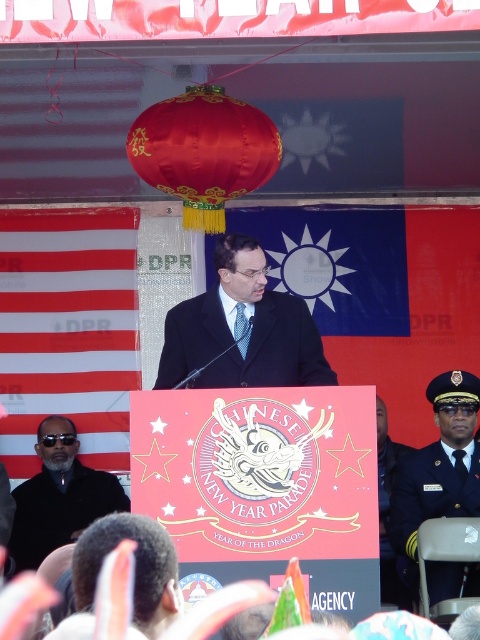
Which is in front, point (225, 243) or point (384, 536)?

Point (225, 243) is in front.

Does matte black suit at center come behind dark blue uniform at right?

That is False.

Does point (271, 291) come farther from viewer compared to point (384, 586)?

That is False.

I want to click on matte black suit at center, so click(241, 330).

Between shiny silk paper lantern at upper center and black matte coat at left, which one is positioned higher?

Positioned higher is shiny silk paper lantern at upper center.

Is point (232, 116) closer to viewer compared to point (47, 440)?

Yes, it is in front of point (47, 440).

At what (x,y) coordinates should I click in order to perform the action: click on shiny silk paper lantern at upper center. Please return your answer as a coordinate pair (x, y). Looking at the image, I should click on (204, 150).

Does black matte coat at left have a lesser height compared to dark blue uniform at right?

No.

Can you confirm if black matte coat at left is positioned below dark blue uniform at right?

Yes, black matte coat at left is below dark blue uniform at right.

Image resolution: width=480 pixels, height=640 pixels. I want to click on black matte coat at left, so click(59, 496).